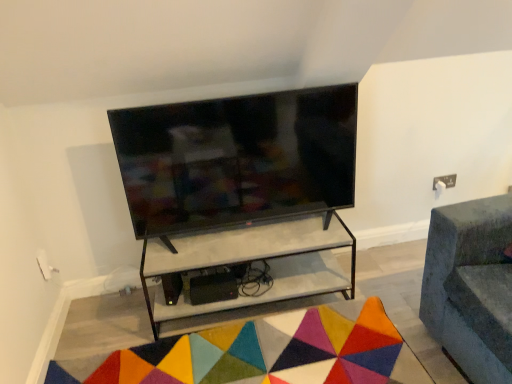
Question: Is white marble shelf at center positioned with its back to multicolored felt mat at lower center?

Choices:
 (A) no
 (B) yes

Answer: (A)

Question: Is white marble shelf at center next to multicolored felt mat at lower center and touching it?

Choices:
 (A) yes
 (B) no

Answer: (B)

Question: Is white marble shelf at center completely or partially outside of multicolored felt mat at lower center?

Choices:
 (A) yes
 (B) no

Answer: (A)

Question: Is white marble shelf at center wider than multicolored felt mat at lower center?

Choices:
 (A) no
 (B) yes

Answer: (A)

Question: Can you confirm if white marble shelf at center is positioned to the left of multicolored felt mat at lower center?

Choices:
 (A) yes
 (B) no

Answer: (B)

Question: Is white marble shelf at center smaller than multicolored felt mat at lower center?

Choices:
 (A) no
 (B) yes

Answer: (A)

Question: Considering the relative sizes of matte black tv at center and white marble shelf at center in the image provided, is matte black tv at center shorter than white marble shelf at center?

Choices:
 (A) no
 (B) yes

Answer: (A)

Question: Can you confirm if matte black tv at center is bigger than white marble shelf at center?

Choices:
 (A) no
 (B) yes

Answer: (A)

Question: Is the depth of matte black tv at center greater than that of white marble shelf at center?

Choices:
 (A) no
 (B) yes

Answer: (A)

Question: Is matte black tv at center not near white marble shelf at center?

Choices:
 (A) yes
 (B) no

Answer: (B)

Question: Is matte black tv at center to the left of white marble shelf at center from the viewer's perspective?

Choices:
 (A) yes
 (B) no

Answer: (A)

Question: Considering the relative sizes of matte black tv at center and white marble shelf at center in the image provided, is matte black tv at center wider than white marble shelf at center?

Choices:
 (A) yes
 (B) no

Answer: (B)

Question: Is multicolored felt mat at lower center positioned far away from white marble shelf at center?

Choices:
 (A) yes
 (B) no

Answer: (B)